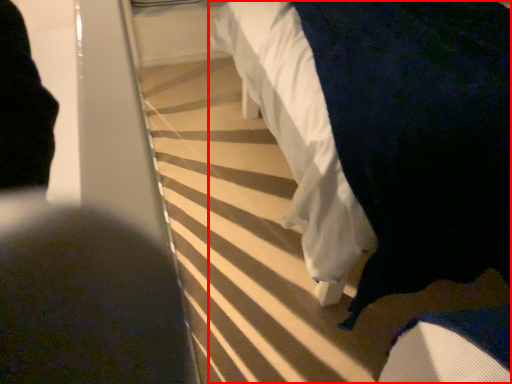
Question: From the image's perspective, where is furniture (annotated by the red box) located in relation to person in the image?

Choices:
 (A) above
 (B) below

Answer: (B)